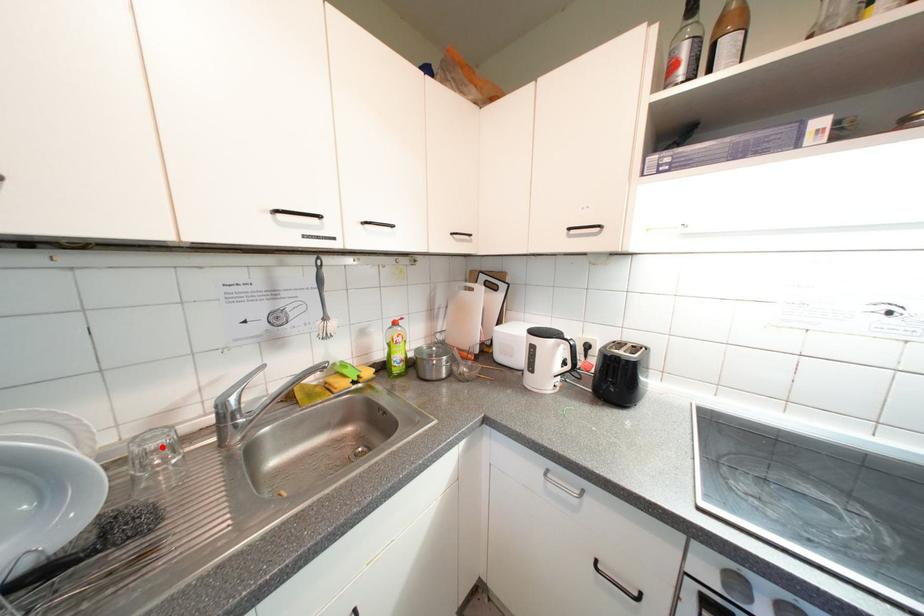
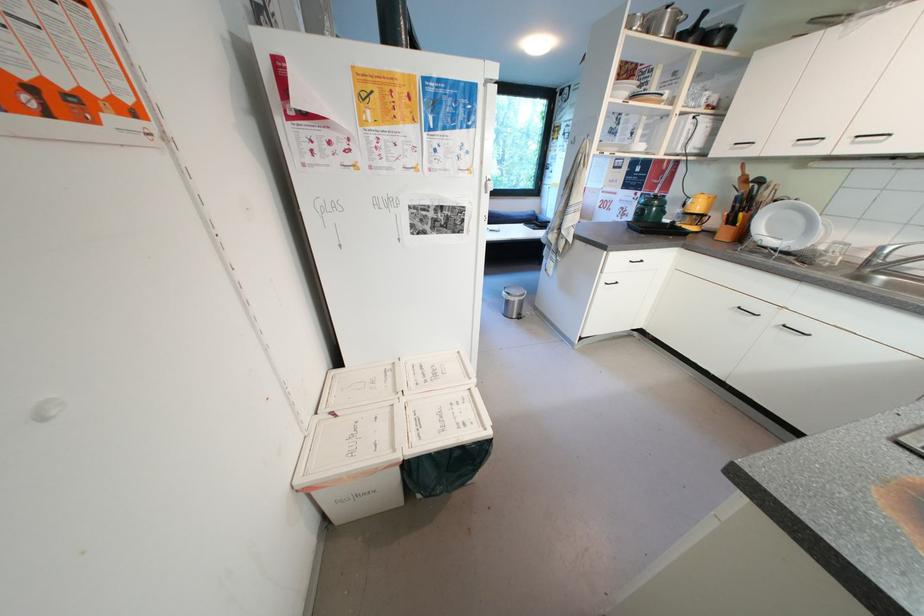
Locate, in the second image, the point that corresponds to the highlighted location in the first image.

(845, 249)